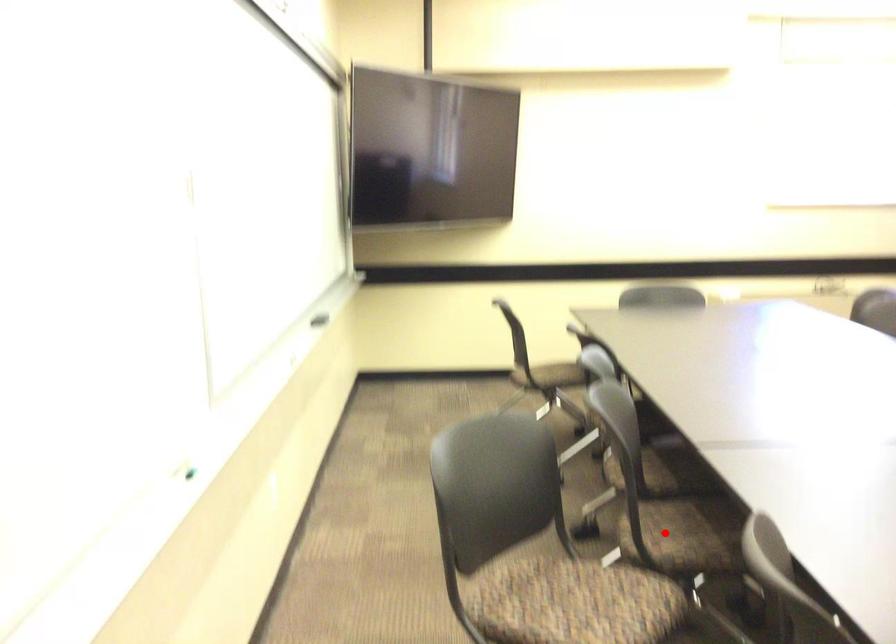
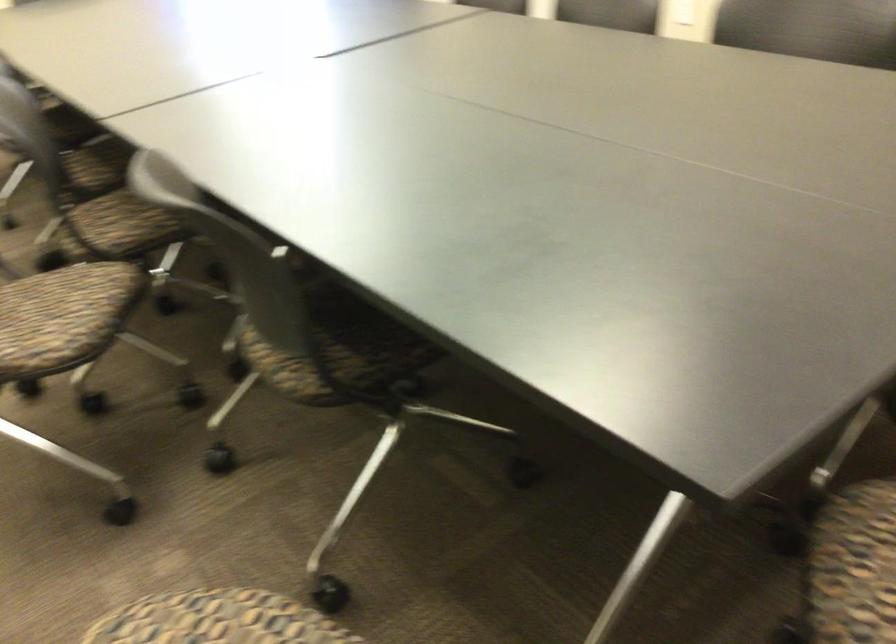
Find the pixel in the second image that matches the highlighted location in the first image.

(122, 223)